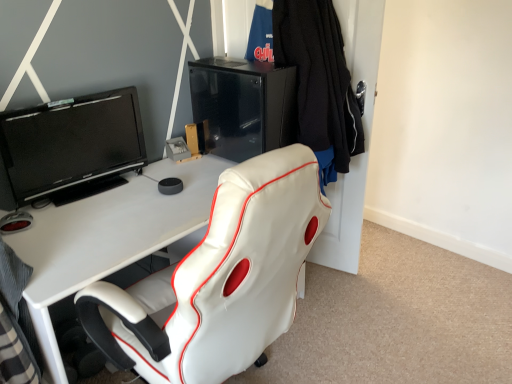
The width and height of the screenshot is (512, 384). What do you see at coordinates (68, 144) in the screenshot?
I see `black glossy screen at upper left` at bounding box center [68, 144].

Measure the distance between black knitted sweater at upper right and camera.

black knitted sweater at upper right and camera are 1.71 meters apart.

In order to click on matte black entertainment center at upper center in this screenshot , I will do `click(365, 136)`.

Does matte black entertainment center at upper center have a lesser height compared to black glossy screen at upper left?

In fact, matte black entertainment center at upper center may be taller than black glossy screen at upper left.

Is matte black entertainment center at upper center further to camera compared to black glossy screen at upper left?

No.

Is black glossy screen at upper left closer to the viewer compared to black knitted sweater at upper right?

Yes, black glossy screen at upper left is closer to the camera.

This screenshot has height=384, width=512. Identify the location of clothing behind the black glossy screen at upper left. (319, 77).

Choose the correct answer: Is black glossy screen at upper left inside black knitted sweater at upper right or outside it?

The correct answer is: outside.

Can you confirm if black knitted sweater at upper right is positioned to the right of black glossy screen at upper left?

Yes.

Does black knitted sweater at upper right have a lesser width compared to black glossy screen at upper left?

No.

Which object is wider, black glossy screen at upper left or matte black entertainment center at upper center?

matte black entertainment center at upper center.

Is black glossy screen at upper left oriented away from matte black entertainment center at upper center?

No, black glossy screen at upper left is not facing away from matte black entertainment center at upper center.

Does black glossy screen at upper left come in front of matte black entertainment center at upper center?

That is False.

Which of these two, black glossy screen at upper left or matte black entertainment center at upper center, stands taller?

With more height is matte black entertainment center at upper center.

How many degrees apart are the facing directions of black knitted sweater at upper right and matte black entertainment center at upper center?

black knitted sweater at upper right and matte black entertainment center at upper center are facing 104 degrees away from each other.

Is point (304, 43) more distant than point (227, 20)?

That is False.

Considering their positions, is black knitted sweater at upper right located in front of or behind matte black entertainment center at upper center?

Clearly, black knitted sweater at upper right is behind matte black entertainment center at upper center.

Considering the relative positions of black knitted sweater at upper right and matte black entertainment center at upper center in the image provided, is black knitted sweater at upper right to the left or to the right of matte black entertainment center at upper center?

Based on their positions, black knitted sweater at upper right is located to the right of matte black entertainment center at upper center.

What's the angular difference between black glossy/file cabinet at upper center and black knitted sweater at upper right's facing directions?

The angle between the facing direction of black glossy/file cabinet at upper center and the facing direction of black knitted sweater at upper right is 77.5 degrees.

In the scene shown: Is black glossy/file cabinet at upper center bigger than black knitted sweater at upper right?

Actually, black glossy/file cabinet at upper center might be smaller than black knitted sweater at upper right.

From the image's perspective, relative to black knitted sweater at upper right, is black glossy/file cabinet at upper center above or below?

Based on their image positions, black glossy/file cabinet at upper center is located beneath black knitted sweater at upper right.

Which object is positioned more to the right, black glossy/file cabinet at upper center or black glossy screen at upper left?

Positioned to the right is black glossy/file cabinet at upper center.

Considering the relative sizes of black glossy/file cabinet at upper center and black glossy screen at upper left in the image provided, is black glossy/file cabinet at upper center smaller than black glossy screen at upper left?

No.

Is black glossy/file cabinet at upper center behind black glossy screen at upper left?

Yes, black glossy/file cabinet at upper center is behind black glossy screen at upper left.

Is black glossy screen at upper left at the back of black glossy/file cabinet at upper center?

No, black glossy/file cabinet at upper center is not facing away from black glossy screen at upper left.

I want to click on television above the matte black entertainment center at upper center (from the image's perspective), so click(x=68, y=144).

Where is `television below the black knitted sweater at upper right (from a real-world perspective)`? television below the black knitted sweater at upper right (from a real-world perspective) is located at coordinates (68, 144).

From the image, which object appears to be farther from black knitted sweater at upper right, matte black entertainment center at upper center or black glossy screen at upper left?

black glossy screen at upper left lies further to black knitted sweater at upper right than the other object.

Looking at this image, looking at the image, which one is located further to black glossy/file cabinet at upper center, black knitted sweater at upper right or black glossy screen at upper left?

Based on the image, black glossy screen at upper left appears to be further to black glossy/file cabinet at upper center.

Looking at the image, which one is located further to black glossy screen at upper left, black glossy/file cabinet at upper center or black knitted sweater at upper right?

Based on the image, black knitted sweater at upper right appears to be further to black glossy screen at upper left.

Considering their positions, is black glossy screen at upper left positioned closer to black glossy/file cabinet at upper center than matte black entertainment center at upper center?

Among the two, black glossy screen at upper left is located nearer to black glossy/file cabinet at upper center.

From the image, which object appears to be farther from black knitted sweater at upper right, black glossy screen at upper left or black glossy/file cabinet at upper center?

Based on the image, black glossy screen at upper left appears to be further to black knitted sweater at upper right.

When comparing their distances from matte black entertainment center at upper center, does black knitted sweater at upper right or black glossy screen at upper left seem further?

Based on the image, black glossy screen at upper left appears to be further to matte black entertainment center at upper center.

When comparing their distances from black glossy screen at upper left, does black knitted sweater at upper right or black glossy/file cabinet at upper center seem closer?

black glossy/file cabinet at upper center is closer to black glossy screen at upper left.

Estimate the real-world distances between objects in this image. Which object is further from black glossy screen at upper left, black knitted sweater at upper right or matte black entertainment center at upper center?

Based on the image, matte black entertainment center at upper center appears to be further to black glossy screen at upper left.

I want to click on entertainment center between black glossy screen at upper left and black knitted sweater at upper right, so click(365, 136).

The image size is (512, 384). I want to click on file cabinet between black glossy screen at upper left and black knitted sweater at upper right from left to right, so click(244, 105).

Find the location of a particular element. Image resolution: width=512 pixels, height=384 pixels. television between matte black entertainment center at upper center and black glossy/file cabinet at upper center along the z-axis is located at coordinates (68, 144).

The height and width of the screenshot is (384, 512). I want to click on clothing between matte black entertainment center at upper center and black glossy/file cabinet at upper center along the z-axis, so click(x=319, y=77).